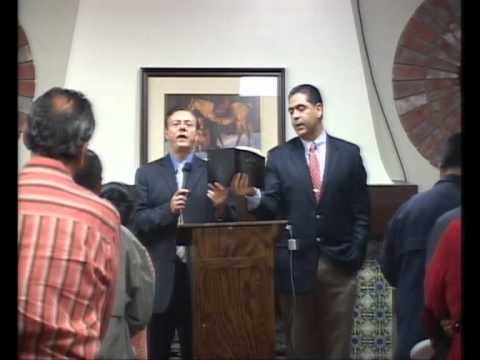
Image resolution: width=480 pixels, height=360 pixels. Identify the location of picture frame. (146, 80).